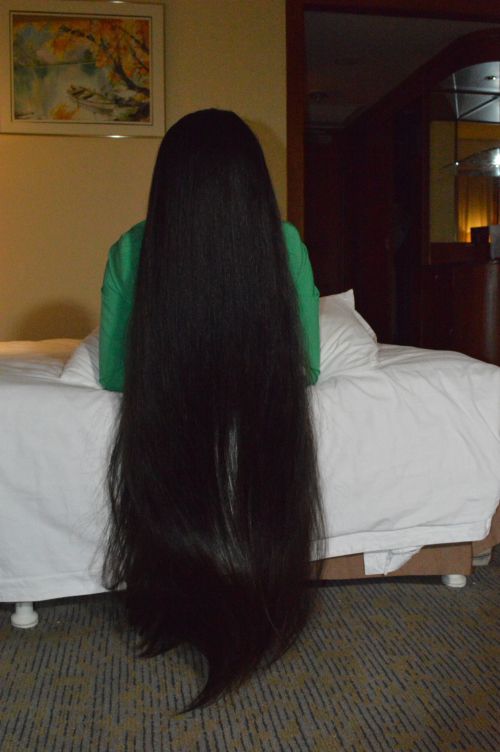
At what (x,y) coordinates should I click in order to perform the action: click on wall. Please return your answer as a coordinate pair (x, y). Looking at the image, I should click on (254, 95).